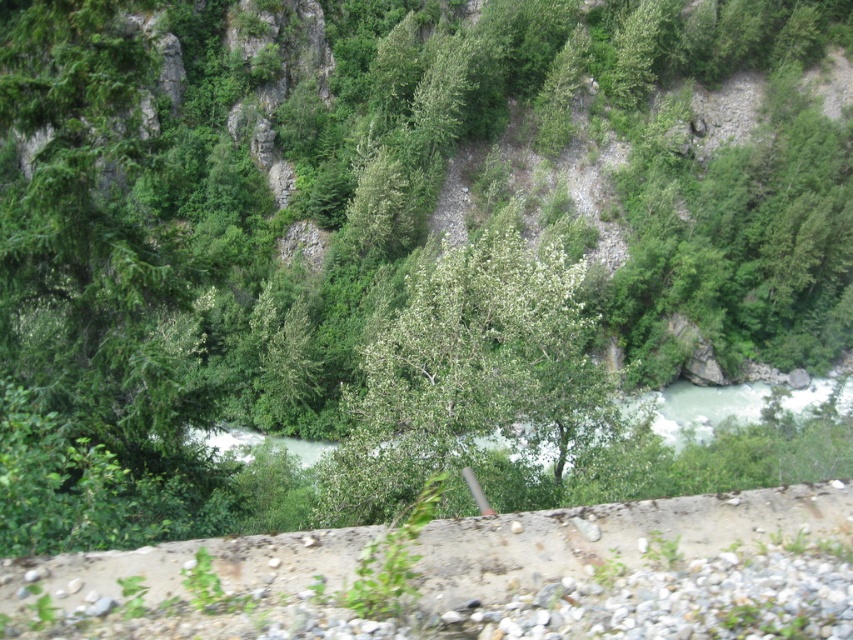
Question: Can you confirm if green matte tree at left is smaller than green leafy tree at center?

Choices:
 (A) yes
 (B) no

Answer: (B)

Question: Which of the following is the farthest from the observer?

Choices:
 (A) green matte tree at left
 (B) green leafy tree at center

Answer: (B)

Question: Which point is closer to the camera?

Choices:
 (A) green matte tree at left
 (B) green leafy tree at center

Answer: (A)

Question: Is green matte tree at left closer to the viewer compared to green leafy tree at center?

Choices:
 (A) no
 (B) yes

Answer: (B)

Question: Does green matte tree at left have a larger size compared to green leafy tree at center?

Choices:
 (A) yes
 (B) no

Answer: (A)